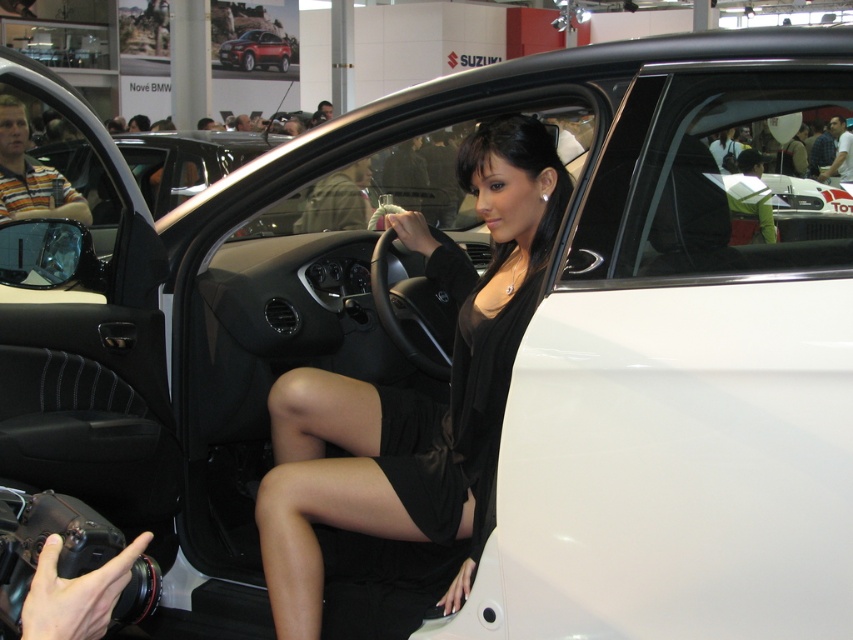
Question: Which of the following is the farthest from the observer?

Choices:
 (A) black satin dress at center
 (B) black matte dress at center

Answer: (B)

Question: Is black matte dress at center positioned at the back of metallic red suv at upper center?

Choices:
 (A) no
 (B) yes

Answer: (A)

Question: Which object is closer to the camera taking this photo?

Choices:
 (A) metallic red suv at upper center
 (B) black matte dress at center
 (C) black satin dress at center

Answer: (C)

Question: Is black matte dress at center to the right of metallic red suv at upper center from the viewer's perspective?

Choices:
 (A) no
 (B) yes

Answer: (B)

Question: Which point is closer to the camera taking this photo?

Choices:
 (A) (277, 65)
 (B) (379, 461)
 (C) (403, 500)

Answer: (C)

Question: Considering the relative positions of black matte dress at center and black satin dress at center in the image provided, where is black matte dress at center located with respect to black satin dress at center?

Choices:
 (A) below
 (B) above

Answer: (B)